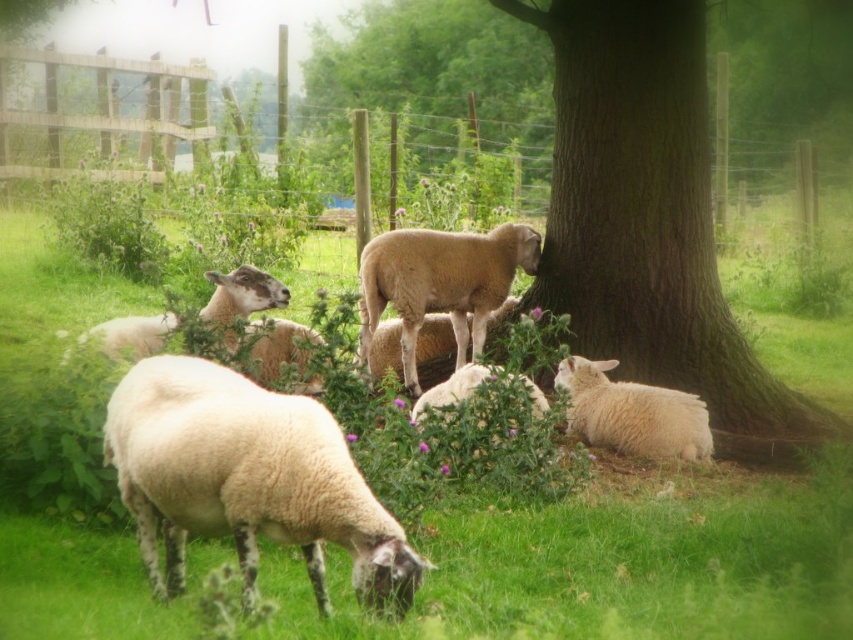
In the serene pastoral scene, there is a green rough bark tree at center and a fuzzy white sheep at center. From the perspective of an observer looking at the image, which object is positioned to the right of the other?

The green rough bark tree at center is positioned to the right of the fuzzy white sheep at center.

You are standing in the field and see the white woolly sheep at lower left and the white woolly sheep at center. Which sheep is closer to you?

The white woolly sheep at lower left is closer to you because it is in front of the white woolly sheep at center.

You are standing at the origin point in the image and want to walk towards the point labeled as point (495, 262). After reaching there, you decide to go further towards point (552, 172). Which direction should you move relative to your current position?

Since point (552, 172) is behind point (495, 262) from your starting position at the origin, you should move in the direction away from the origin to reach point (552, 172).